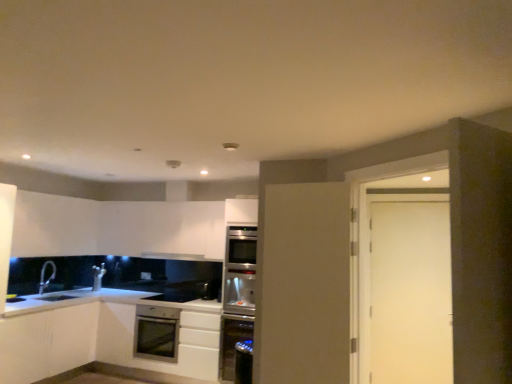
Question: Does satin silver oven at center appear on the left side of satin silver oven at lower center?

Choices:
 (A) yes
 (B) no

Answer: (B)

Question: Can you confirm if satin silver oven at center is positioned to the right of satin silver oven at lower center?

Choices:
 (A) no
 (B) yes

Answer: (B)

Question: Is satin silver oven at center positioned in front of satin silver oven at lower center?

Choices:
 (A) no
 (B) yes

Answer: (B)

Question: Is satin silver oven at center positioned with its back to satin silver oven at lower center?

Choices:
 (A) no
 (B) yes

Answer: (A)

Question: Does satin silver oven at center have a lesser height compared to satin silver oven at lower center?

Choices:
 (A) yes
 (B) no

Answer: (B)

Question: Does satin silver oven at center have a lesser width compared to satin silver oven at lower center?

Choices:
 (A) yes
 (B) no

Answer: (A)

Question: Considering the relative positions of silver metallic faucet at lower left and white matte cabinet at lower left, the second cabinetry viewed from the right, in the image provided, is silver metallic faucet at lower left to the right of white matte cabinet at lower left, the second cabinetry viewed from the right, from the viewer's perspective?

Choices:
 (A) no
 (B) yes

Answer: (A)

Question: Considering the relative sizes of silver metallic faucet at lower left and white matte cabinet at lower left, the second cabinetry viewed from the right, in the image provided, is silver metallic faucet at lower left wider than white matte cabinet at lower left, the second cabinetry viewed from the right,?

Choices:
 (A) yes
 (B) no

Answer: (B)

Question: Is silver metallic faucet at lower left facing away from white matte cabinet at lower left, the 1th cabinetry viewed from the left?

Choices:
 (A) yes
 (B) no

Answer: (B)

Question: Is silver metallic faucet at lower left shorter than white matte cabinet at lower left, the 1th cabinetry viewed from the left?

Choices:
 (A) no
 (B) yes

Answer: (B)

Question: From the image's perspective, is silver metallic faucet at lower left over white matte cabinet at lower left, the 1th cabinetry viewed from the left?

Choices:
 (A) yes
 (B) no

Answer: (A)

Question: Are silver metallic faucet at lower left and white matte cabinet at lower left, the second cabinetry viewed from the right, far apart?

Choices:
 (A) no
 (B) yes

Answer: (A)

Question: Considering the relative positions of satin silver oven at lower center and satin silver oven at center in the image provided, is satin silver oven at lower center to the right of satin silver oven at center from the viewer's perspective?

Choices:
 (A) no
 (B) yes

Answer: (A)